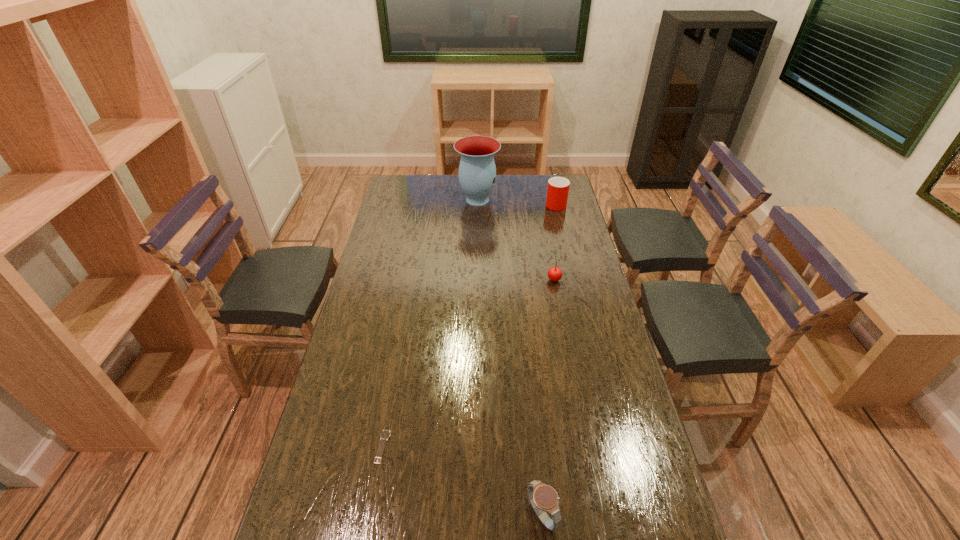
The image size is (960, 540). Identify the location of the fourth object from right to left. (477, 172).

Identify the location of vase. (477, 172).

Where is `cup`? The width and height of the screenshot is (960, 540). cup is located at coordinates (558, 187).

Find the location of `cherry`. cherry is located at coordinates (554, 274).

In order to click on the nearest object in this screenshot , I will do `click(544, 498)`.

Image resolution: width=960 pixels, height=540 pixels. I want to click on the taller watch, so click(x=544, y=498).

Where is `the fourth farthest object`? Image resolution: width=960 pixels, height=540 pixels. the fourth farthest object is located at coordinates pos(385,434).

You are a GUI agent. You are given a task and a screenshot of the screen. Output one action in this format:
    pyautogui.click(x=<x>, y=<y>)
    Task: Click on the left watch
    
    Given the screenshot: What is the action you would take?
    pyautogui.click(x=385, y=434)

What are the coordinates of `vacant space located 0.250m on the left of the fourth object from right to left` in the screenshot? It's located at (403, 200).

At what (x,y) coordinates should I click in order to perform the action: click on free location located on the side of the cup with the handle. Please return your answer as a coordinate pair (x, y). The width and height of the screenshot is (960, 540). Looking at the image, I should click on (552, 191).